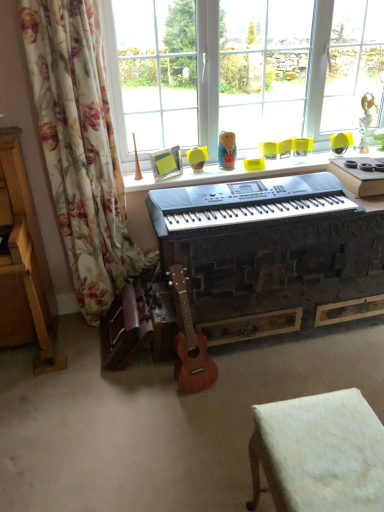
At what (x,y) coordinates should I click in order to perform the action: click on floral fabric curtain at left. Please return your answer as a coordinate pair (x, y). This screenshot has width=384, height=512. Looking at the image, I should click on (81, 148).

This screenshot has height=512, width=384. What do you see at coordinates (240, 71) in the screenshot?
I see `transparent glass window at upper center` at bounding box center [240, 71].

At what (x,y) coordinates should I click in order to perform the action: click on transparent glass window at upper center. Please return your answer as a coordinate pair (x, y). Image resolution: width=384 pixels, height=512 pixels. Looking at the image, I should click on (240, 71).

The height and width of the screenshot is (512, 384). Describe the element at coordinates (227, 150) in the screenshot. I see `matte plastic doll at upper center` at that location.

Locate an element on the screen. white fabric stool at lower right is located at coordinates (319, 453).

This screenshot has height=512, width=384. Find the location of `floral fabric curtain at left`. floral fabric curtain at left is located at coordinates (81, 148).

Consider the image. From the image's perspective, is white fabric stool at lower right above or below transparent glass window at upper center?

white fabric stool at lower right is situated lower than transparent glass window at upper center in the image.

Are white fabric stool at lower right and transparent glass window at upper center located far from each other?

white fabric stool at lower right is far away from transparent glass window at upper center.

Which is more to the left, white fabric stool at lower right or transparent glass window at upper center?

white fabric stool at lower right is more to the left.

Which is closer, (x=305, y=471) or (x=195, y=106)?

The point (x=305, y=471) is closer.

Where is `piano below the matte plastic doll at upper center (from a real-world perspective)`? piano below the matte plastic doll at upper center (from a real-world perspective) is located at coordinates (268, 252).

From a real-world perspective, which object stands above the other?

matte plastic doll at upper center, from a real-world perspective.

From the image's perspective, does black plastic keyboard at center appear higher than matte plastic doll at upper center?

No, from the image's perspective, black plastic keyboard at center is not above matte plastic doll at upper center.

From a real-world perspective, which object stands above the other?

transparent glass window at upper center, from a real-world perspective.

Based on the photo, which is correct: transparent glass window at upper center is inside floral fabric curtain at left, or outside of it?

transparent glass window at upper center is spatially situated outside floral fabric curtain at left.

Consider the image. In terms of size, does transparent glass window at upper center appear bigger or smaller than floral fabric curtain at left?

In the image, transparent glass window at upper center appears to be larger than floral fabric curtain at left.

Can you confirm if transparent glass window at upper center is thinner than floral fabric curtain at left?

No.

Locate an element on the screen. window screen on the right of the white fabric stool at lower right is located at coordinates (240, 71).

Can you confirm if transparent glass window at upper center is taller than white fabric stool at lower right?

Correct, transparent glass window at upper center is much taller as white fabric stool at lower right.

Is transparent glass window at upper center to the left of white fabric stool at lower right from the viewer's perspective?

In fact, transparent glass window at upper center is to the right of white fabric stool at lower right.

From a real-world perspective, is transparent glass window at upper center below white fabric stool at lower right?

No, from a real-world perspective, transparent glass window at upper center is not below white fabric stool at lower right.

From a real-world perspective, is transparent glass window at upper center physically above wooden acoustic guitar at center?

Yes, from a real-world perspective, transparent glass window at upper center is above wooden acoustic guitar at center.

Is transparent glass window at upper center wider than wooden acoustic guitar at center?

Yes.

From the image's perspective, which object appears higher, transparent glass window at upper center or wooden acoustic guitar at center?

transparent glass window at upper center appears higher in the image.

Considering the sizes of objects floral fabric curtain at left and black plastic keyboard at center in the image provided, who is taller, floral fabric curtain at left or black plastic keyboard at center?

floral fabric curtain at left is taller.

You are a GUI agent. You are given a task and a screenshot of the screen. Output one action in this format:
    pyautogui.click(x=<x>, y=<y>)
    Task: Click on the curtain that appears in front of the black plastic keyboard at center
    The height and width of the screenshot is (512, 384).
    Given the screenshot: What is the action you would take?
    pyautogui.click(x=81, y=148)

From a real-world perspective, is floral fabric curtain at left under black plastic keyboard at center?

Incorrect, from a real-world perspective, floral fabric curtain at left is higher than black plastic keyboard at center.

Could you tell me if transparent glass window at upper center is turned towards black plastic keyboard at center?

No, transparent glass window at upper center is not facing towards black plastic keyboard at center.

Does transparent glass window at upper center have a greater height compared to black plastic keyboard at center?

Yes, transparent glass window at upper center is taller than black plastic keyboard at center.

Would you say transparent glass window at upper center contains black plastic keyboard at center?

That's incorrect, black plastic keyboard at center is not inside transparent glass window at upper center.

Identify the location of window screen that is on the right side of white fabric stool at lower right. (240, 71).

Locate an element on the screen. The image size is (384, 512). piano below the matte plastic doll at upper center (from a real-world perspective) is located at coordinates (268, 252).

From the image, which object appears to be farther from wooden acoustic guitar at center, black plastic keyboard at center or matte plastic doll at upper center?

matte plastic doll at upper center lies further to wooden acoustic guitar at center than the other object.

Based on their spatial positions, is floral fabric curtain at left or black plastic keyboard at center further from matte yellow armchair at center?

Among the two, floral fabric curtain at left is located further to matte yellow armchair at center.

Based on their spatial positions, is wooden acoustic guitar at center or matte yellow armchair at center further from transparent glass window at upper center?

wooden acoustic guitar at center is further to transparent glass window at upper center.

Looking at the image, which one is located further to transparent glass window at upper center, black plastic keyboard at center or black plastic keyboard at center?

black plastic keyboard at center.

Considering their positions, is white fabric stool at lower right positioned closer to matte yellow armchair at center than wooden acoustic guitar at center?

The object closer to matte yellow armchair at center is wooden acoustic guitar at center.

Looking at the image, which one is located further to black plastic keyboard at center, transparent glass window at upper center or floral fabric curtain at left?

Based on the image, transparent glass window at upper center appears to be further to black plastic keyboard at center.

Consider the image. Looking at the image, which one is located closer to white fabric stool at lower right, matte plastic doll at upper center or black plastic keyboard at center?

Based on the image, black plastic keyboard at center appears to be nearer to white fabric stool at lower right.

Which object lies nearer to the anchor point black plastic keyboard at center, transparent glass window at upper center or matte plastic doll at upper center?

matte plastic doll at upper center is closer to black plastic keyboard at center.

This screenshot has width=384, height=512. Find the location of `toy located between white fabric stool at lower right and matte yellow armchair at center in the depth direction`. toy located between white fabric stool at lower right and matte yellow armchair at center in the depth direction is located at coordinates (227, 150).

Where is `armchair located between floral fabric curtain at left and transparent glass window at upper center in the left-right direction`? This screenshot has width=384, height=512. armchair located between floral fabric curtain at left and transparent glass window at upper center in the left-right direction is located at coordinates (197, 158).

Find the location of `piano between black plastic keyboard at center and matte yellow armchair at center from front to back`. piano between black plastic keyboard at center and matte yellow armchair at center from front to back is located at coordinates (268, 252).

This screenshot has width=384, height=512. I want to click on guitar between transparent glass window at upper center and white fabric stool at lower right vertically, so click(190, 345).